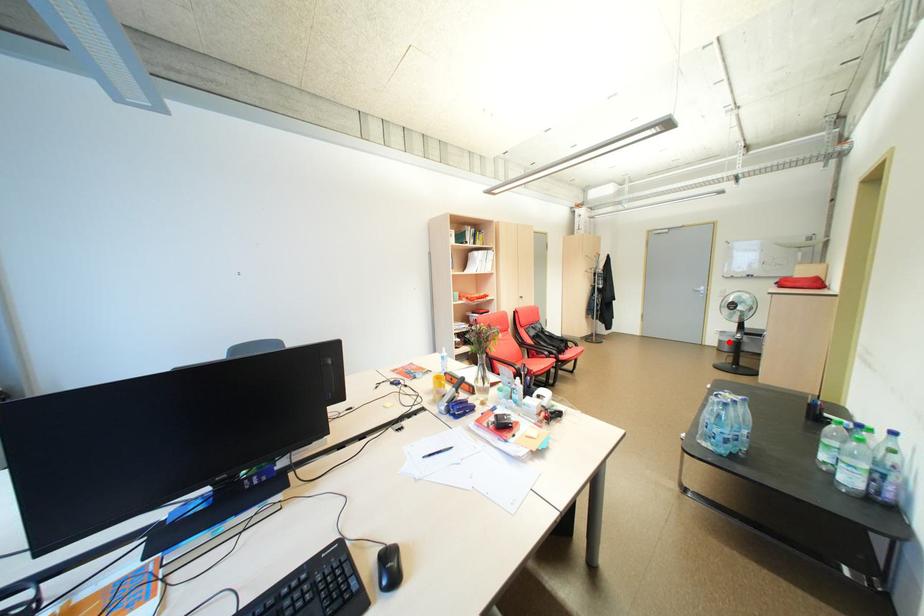
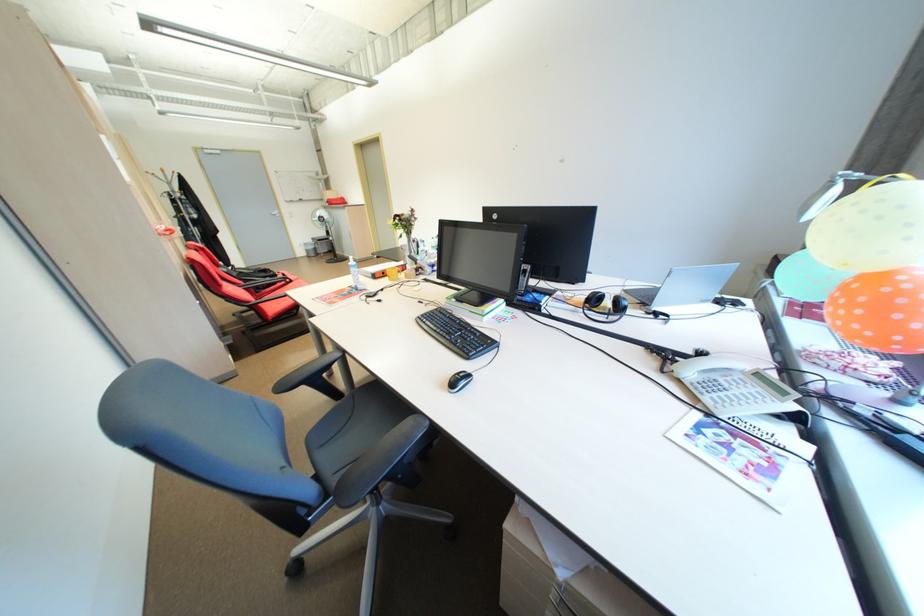
Question: I am providing you with two images of the same scene from different viewpoints. A red point is shown in image1. For the corresponding object point in image2, is it positioned nearer or farther from the camera?

Choices:
 (A) Nearer
 (B) Farther

Answer: (A)